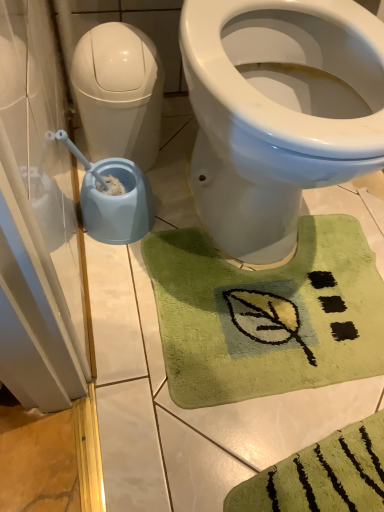
Question: Considering the relative positions of green plush bath mat at lower center and blue plastic bidet at left in the image provided, is green plush bath mat at lower center in front of blue plastic bidet at left?

Choices:
 (A) yes
 (B) no

Answer: (B)

Question: Considering the relative sizes of green plush bath mat at lower center and blue plastic bidet at left in the image provided, is green plush bath mat at lower center wider than blue plastic bidet at left?

Choices:
 (A) no
 (B) yes

Answer: (A)

Question: Is green plush bath mat at lower center smaller than blue plastic bidet at left?

Choices:
 (A) yes
 (B) no

Answer: (A)

Question: From the image's perspective, is green plush bath mat at lower center below blue plastic bidet at left?

Choices:
 (A) no
 (B) yes

Answer: (B)

Question: Is green plush bath mat at lower center with blue plastic bidet at left?

Choices:
 (A) yes
 (B) no

Answer: (B)

Question: In terms of width, does blue plastic bidet at left look wider or thinner when compared to white glossy water tank at left?

Choices:
 (A) wide
 (B) thin

Answer: (A)

Question: Visually, is blue plastic bidet at left positioned to the left or to the right of white glossy water tank at left?

Choices:
 (A) right
 (B) left

Answer: (A)

Question: From the image's perspective, is blue plastic bidet at left positioned above or below white glossy water tank at left?

Choices:
 (A) above
 (B) below

Answer: (A)

Question: From a real-world perspective, relative to white glossy water tank at left, is blue plastic bidet at left vertically above or below?

Choices:
 (A) below
 (B) above

Answer: (B)

Question: From a real-world perspective, relative to white glossy water tank at left, is transparent plastic screen door at left vertically above or below?

Choices:
 (A) below
 (B) above

Answer: (A)

Question: From the image's perspective, is transparent plastic screen door at left above or below white glossy water tank at left?

Choices:
 (A) below
 (B) above

Answer: (A)

Question: Considering the positions of transparent plastic screen door at left and white glossy water tank at left in the image, is transparent plastic screen door at left taller or shorter than white glossy water tank at left?

Choices:
 (A) tall
 (B) short

Answer: (B)

Question: Is transparent plastic screen door at left spatially inside white glossy water tank at left, or outside of it?

Choices:
 (A) inside
 (B) outside

Answer: (B)

Question: Considering the positions of transparent plastic screen door at left and blue plastic bidet at left in the image, is transparent plastic screen door at left bigger or smaller than blue plastic bidet at left?

Choices:
 (A) big
 (B) small

Answer: (B)

Question: In the image, is transparent plastic screen door at left on the left side or the right side of blue plastic bidet at left?

Choices:
 (A) left
 (B) right

Answer: (A)